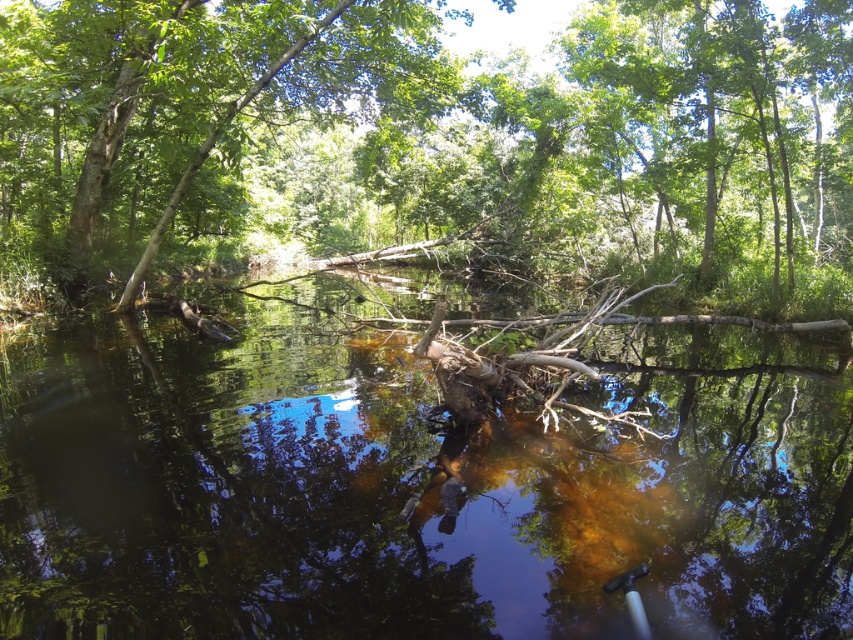
You are standing in the forest and see the brown murky water at center and the green leafy tree at center. Which object is positioned to the right of the other?

The brown murky water at center is to the right of the green leafy tree at center.

You are a photographer planning to take a photo of the brown murky water at center and the green leafy tree at center. Which object should you focus on if you want to capture the larger subject in your shot?

The green leafy tree at center is larger than the brown murky water at center, so you should focus on the green leafy tree at center to capture the larger subject in your shot.

You are a kayaker planning to paddle from the brown murky water at center to the green leafy tree at center. Given that your kayak can travel at 2.5 feet per second, how long will it take you to reach the tree?

The distance between the brown murky water at center and the green leafy tree at center is 41.64 feet. At a speed of 2.5 feet per second, dividing the distance by the speed gives 41.64 divided by 2.5 equals approximately 16.66 seconds. So, it will take roughly 16.7 seconds to reach the tree.